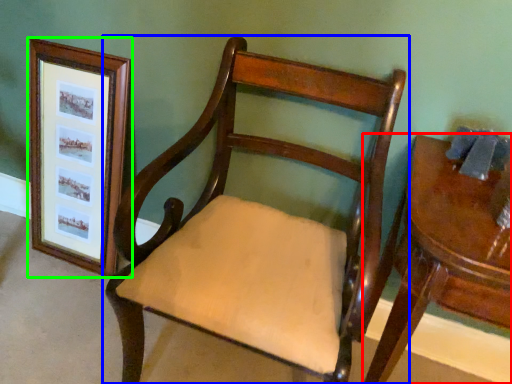
Question: Which object is positioned farthest from table (highlighted by a red box)? Select from chair (highlighted by a blue box) and picture frame (highlighted by a green box).

Choices:
 (A) chair
 (B) picture frame

Answer: (B)